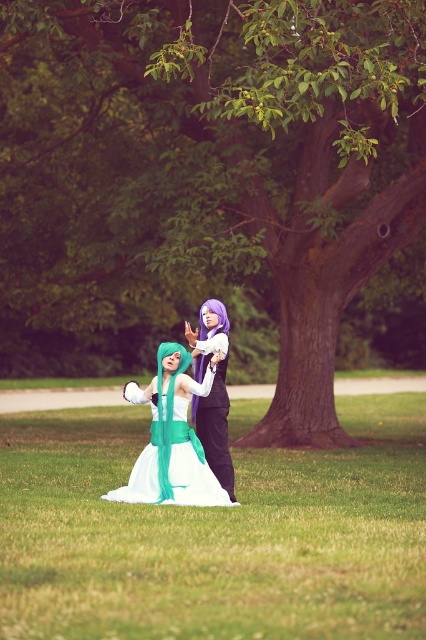
Question: Does green leafy tree at center have a lesser width compared to white satin dress at center?

Choices:
 (A) no
 (B) yes

Answer: (A)

Question: Among these objects, which one is farthest from the camera?

Choices:
 (A) white satin dress at center
 (B) green leafy tree at center

Answer: (B)

Question: Which of these objects is positioned closest to the green leafy tree at center?

Choices:
 (A) white satin dress at center
 (B) green grass at center

Answer: (B)

Question: Is green grass at center to the right of white satin dress at center from the viewer's perspective?

Choices:
 (A) yes
 (B) no

Answer: (B)

Question: Which of these objects is positioned farthest from the green leafy tree at center?

Choices:
 (A) white satin dress at center
 (B) green grass at center

Answer: (A)

Question: Does green leafy tree at center appear on the left side of green grass at center?

Choices:
 (A) yes
 (B) no

Answer: (A)